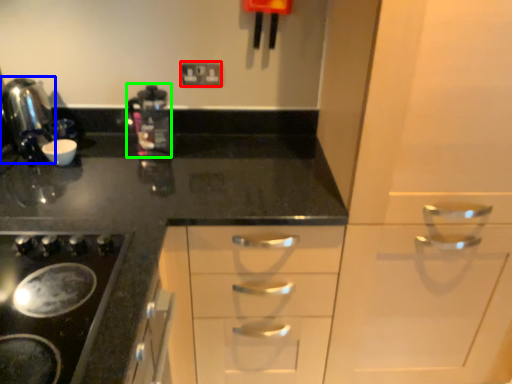
Question: Based on their relative distances, which object is nearer to electric outlet (highlighted by a red box)? Choose from kitchen appliance (highlighted by a blue box) and coffee machine (highlighted by a green box).

Choices:
 (A) kitchen appliance
 (B) coffee machine

Answer: (B)